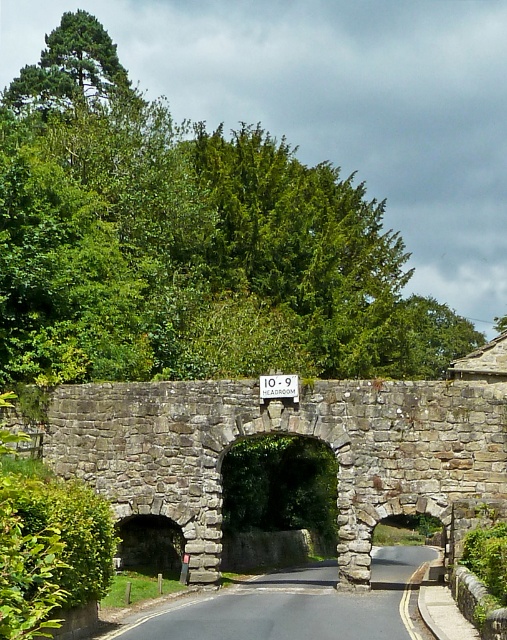
You are driving a tall truck and need to pass under the stone archway at center. There is a white plastic sign at center indicating the headroom. Can you see the sign while looking at the archway from your current position?

The stone archway at center is closer to the viewer than the white plastic sign at center, so the sign is behind the archway and might not be visible from your current position.

From the picture: You are driving a truck that is 10 feet 6 inches tall. You see the stone archway at center and the white plastic sign at center. Based on the scene, can your truck safely pass under the archway?

The white plastic sign at center indicates a 10 foot 9 inch headroom. Since your truck is 10 feet 6 inches tall, which is shorter than the indicated headroom, your truck can safely pass under the stone archway at center.